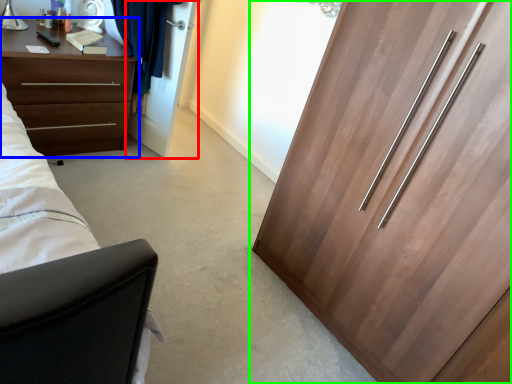
Question: Which is nearer to the door (highlighted by a red box)? chest of drawers (highlighted by a blue box) or cupboard (highlighted by a green box).

Choices:
 (A) chest of drawers
 (B) cupboard

Answer: (A)